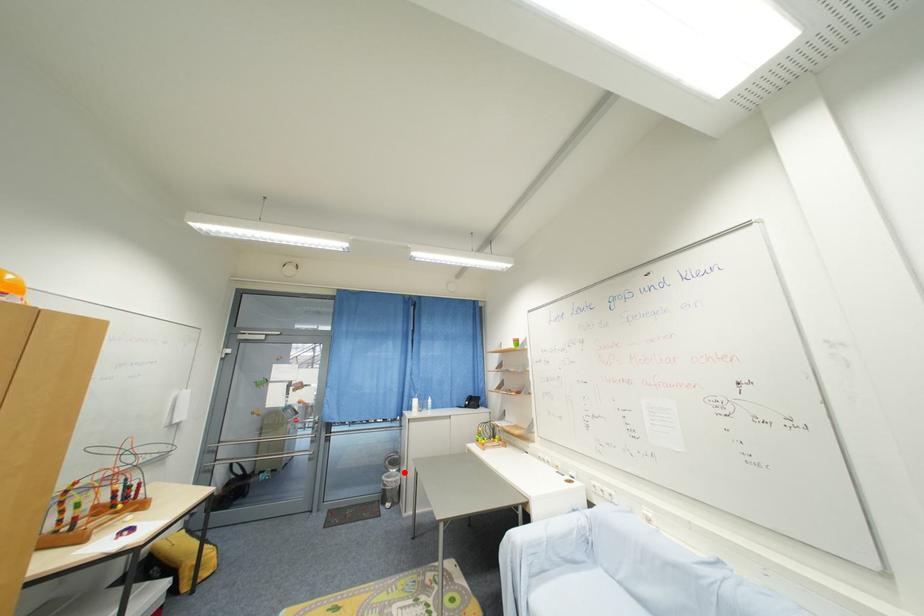
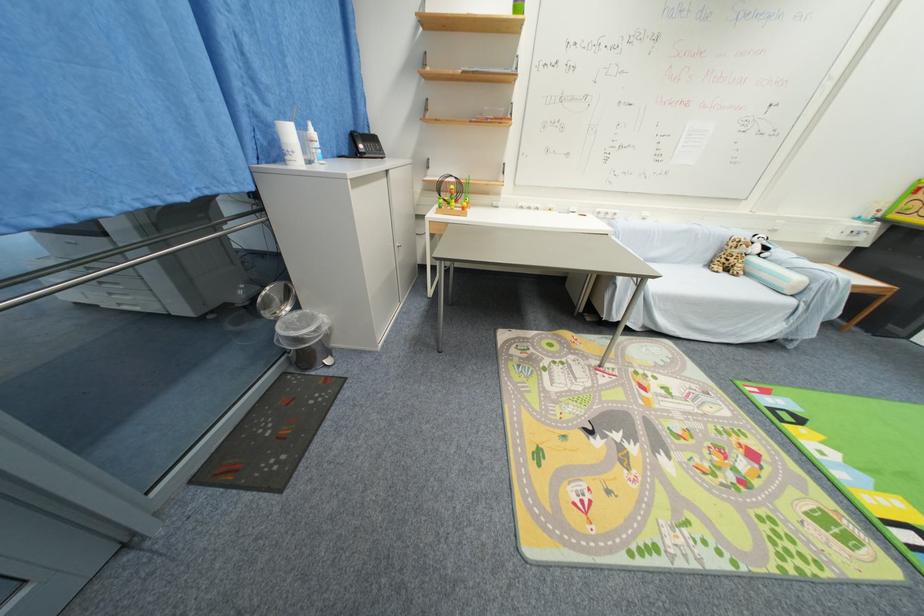
Where in the second image is the point corresponding to the highlighted location from the first image?

(301, 309)